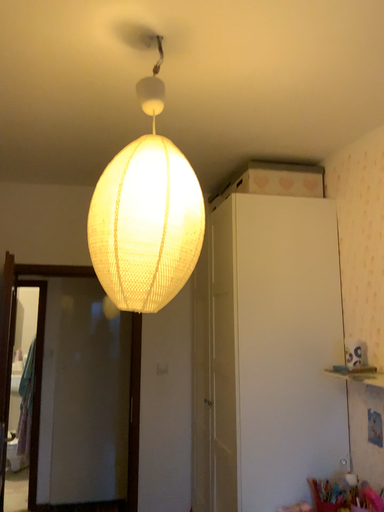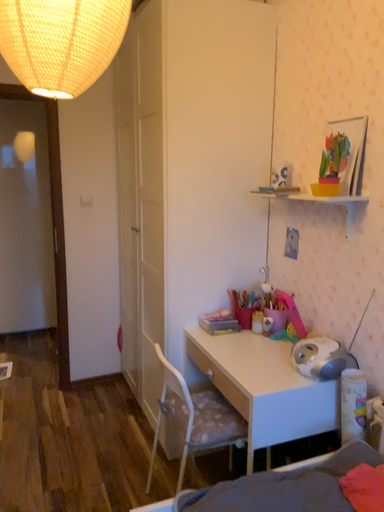
Question: How did the camera likely rotate when shooting the video?

Choices:
 (A) rotated upward
 (B) rotated downward

Answer: (B)